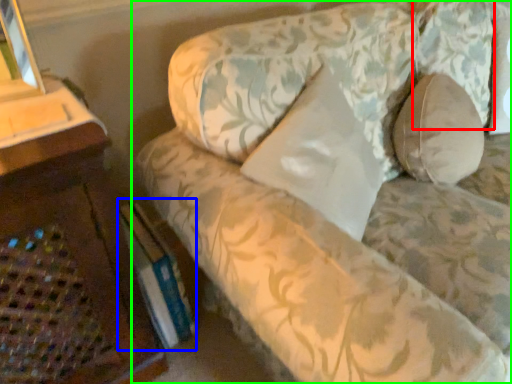
Question: Considering the real-world distances, which object is closest to pillow (highlighted by a red box)? paperback book (highlighted by a blue box) or studio couch (highlighted by a green box).

Choices:
 (A) paperback book
 (B) studio couch

Answer: (B)